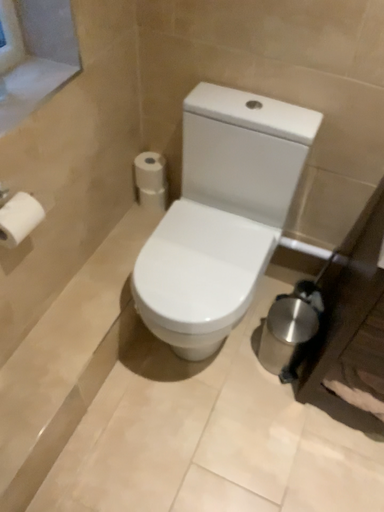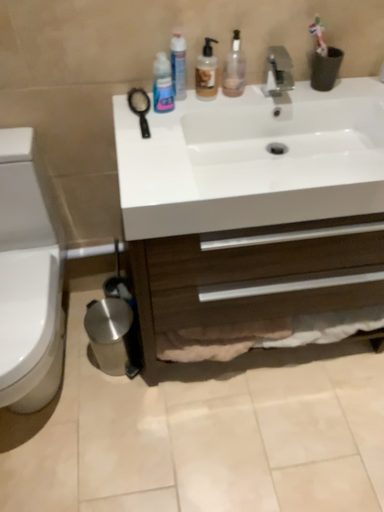
Question: How did the camera likely rotate when shooting the video?

Choices:
 (A) rotated downward
 (B) rotated upward

Answer: (B)